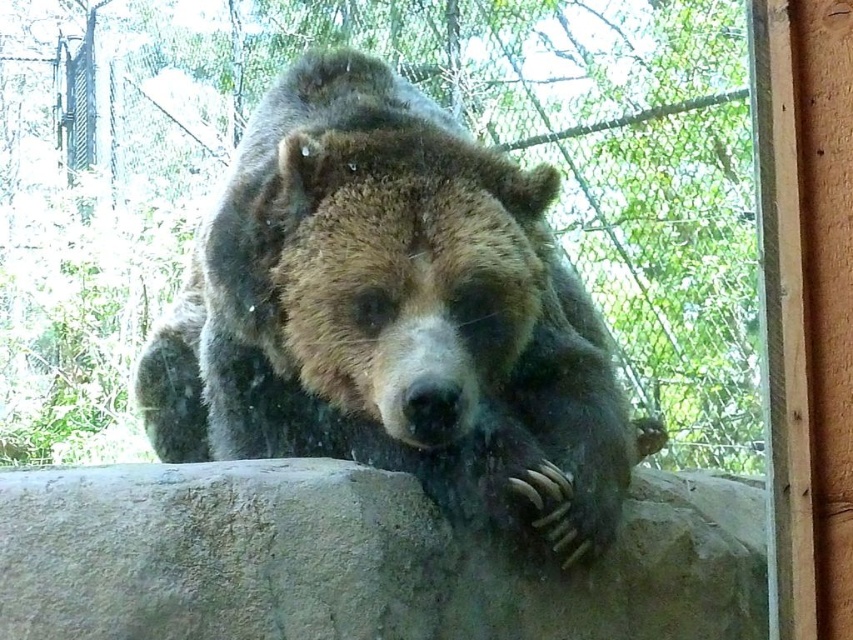
Between fuzzy brown bear at center and gray rough boulder at center, which one is positioned lower?

gray rough boulder at center is below.

Is point (381, 353) positioned in front of point (172, 522)?

No, (381, 353) is behind (172, 522).

I want to click on fuzzy brown bear at center, so click(395, 316).